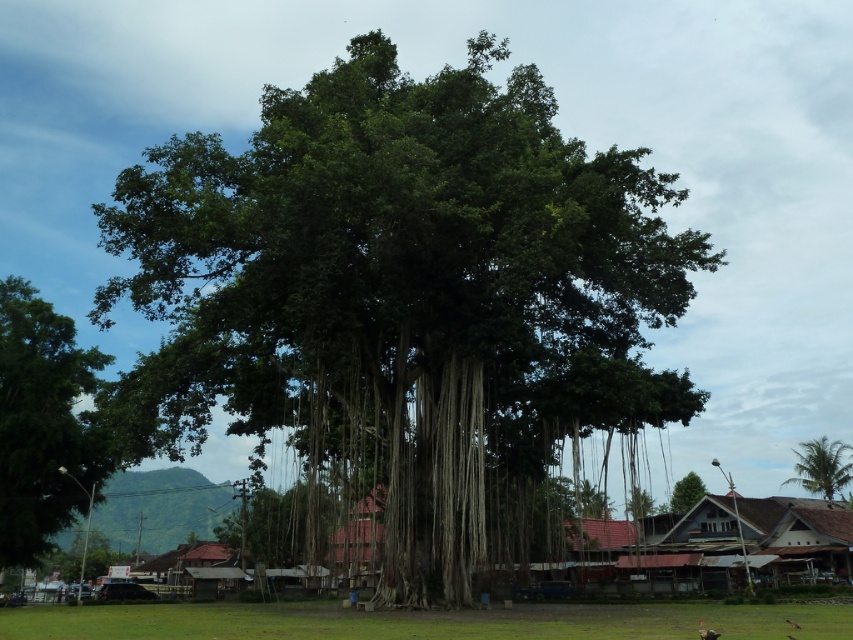
You are planning to install a small solar panel on the roof of the brown corrugated metal hut at lower right. Considering the size of the green leafy tree at left, will the solar panel receive enough sunlight throughout the day?

The green leafy tree at left is bigger than the brown corrugated metal hut at lower right. Since the tree is larger, its dense foliage might cast significant shade, potentially reducing sunlight availability for the solar panel. However, the exact impact depends on the tree canopy spread and the hut roof orientation.

You are standing in front of the large banyan tree and want to take a photo that includes both the point at coordinates point [585,236] and point [123,632]. Which point should you focus on first to ensure both are in focus?

You should focus on point [585,236] first because it is closer to the camera than point [123,632], ensuring both points are within the depth of field.

You are planning to install a bird feeder in the park. The bird feeder requires a tree that is at least 10 meters tall. Given the information about the green leafy banyan tree at center and the green leafy tree at left, which tree would be suitable for installing the bird feeder?

The green leafy banyan tree at center is much taller than the green leafy tree at left, so it would be suitable for installing the bird feeder as it likely meets the height requirement of at least 10 meters.